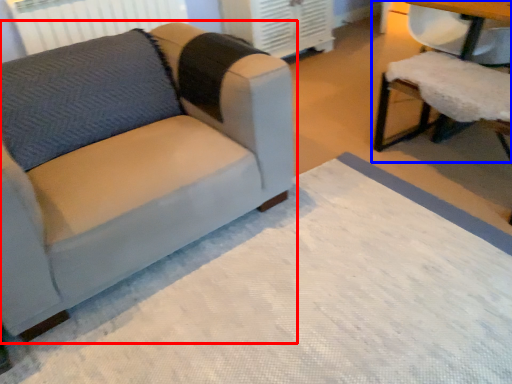
Question: Which object appears farthest to the camera in this image, studio couch (highlighted by a red box) or chair (highlighted by a blue box)?

Choices:
 (A) studio couch
 (B) chair

Answer: (B)